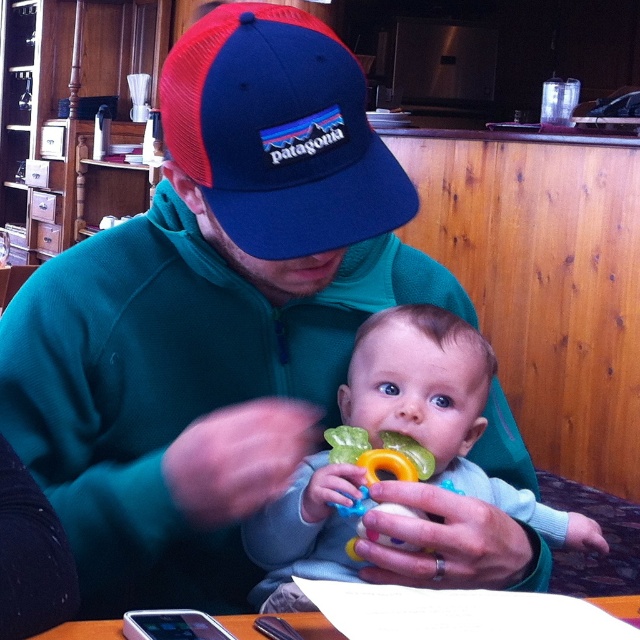
Who is higher up, light blue fabric baby at center or translucent plastic teething ring at center?

light blue fabric baby at center is above.

Does point (356, 410) come behind point (440, 576)?

Yes, point (356, 410) is behind point (440, 576).

The width and height of the screenshot is (640, 640). Describe the element at coordinates (442, 408) in the screenshot. I see `light blue fabric baby at center` at that location.

You are a GUI agent. You are given a task and a screenshot of the screen. Output one action in this format:
    pyautogui.click(x=<x>, y=<y>)
    Task: Click on the light blue fabric baby at center
    The image size is (640, 640).
    Given the screenshot: What is the action you would take?
    [442, 408]

Between point (282, 211) and point (440, 557), which one is positioned in front?

Point (282, 211) is more forward.

Does point (227, 122) come behind point (436, 580)?

No, (227, 122) is closer to viewer.

Find the location of a particular element. Image resolution: width=640 pixels, height=640 pixels. blue mesh baseball cap at upper center is located at coordinates (280, 132).

Can you confirm if light blue fabric baby at center is positioned to the left of wooden table at lower center?

No, light blue fabric baby at center is not to the left of wooden table at lower center.

Does light blue fabric baby at center have a greater height compared to wooden table at lower center?

Indeed, light blue fabric baby at center has a greater height compared to wooden table at lower center.

Does point (289, 496) come in front of point (317, 624)?

No, it is not.

Where is `light blue fabric baby at center`? This screenshot has width=640, height=640. light blue fabric baby at center is located at coordinates (442, 408).